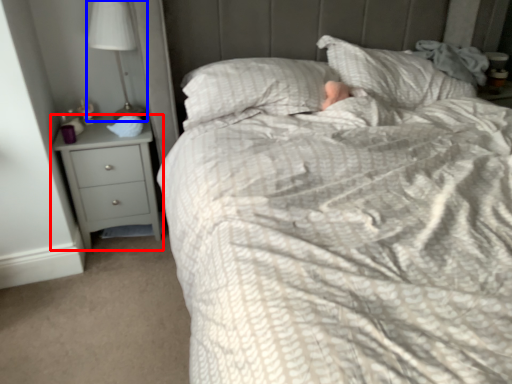
Question: Which object is closer to the camera taking this photo, chest of drawers (highlighted by a red box) or lamp (highlighted by a blue box)?

Choices:
 (A) chest of drawers
 (B) lamp

Answer: (B)